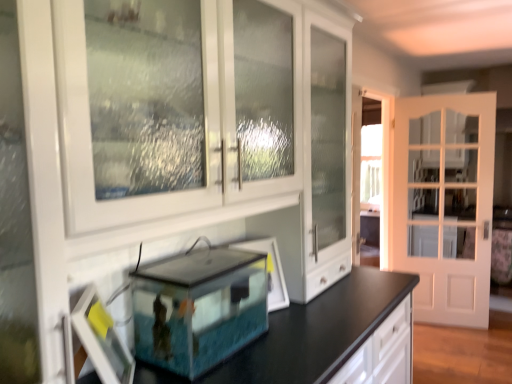
Question: Does clear glass picture frame at center, acting as the first picture frame starting from the right, contain white glossy cabinet at center?

Choices:
 (A) yes
 (B) no

Answer: (B)

Question: From a real-world perspective, is clear glass picture frame at center, positioned as the 2th picture frame in left-to-right order, below white glossy cabinet at center?

Choices:
 (A) no
 (B) yes

Answer: (B)

Question: Is clear glass picture frame at center, arranged as the second picture frame when viewed from the front, shorter than white glossy cabinet at center?

Choices:
 (A) no
 (B) yes

Answer: (B)

Question: From a real-world perspective, is clear glass picture frame at center, acting as the first picture frame starting from the right, located higher than white glossy cabinet at center?

Choices:
 (A) no
 (B) yes

Answer: (A)

Question: From the image's perspective, is clear glass picture frame at center, the 1th picture frame from the back, on top of white glossy cabinet at center?

Choices:
 (A) yes
 (B) no

Answer: (B)

Question: Is white glossy cabinet at center inside or outside of clear glass picture frame at center, the 1th picture frame from the back?

Choices:
 (A) inside
 (B) outside

Answer: (B)

Question: Is white glossy cabinet at center wider or thinner than clear glass picture frame at center, acting as the first picture frame starting from the right?

Choices:
 (A) thin
 (B) wide

Answer: (B)

Question: Is point (19, 21) positioned closer to the camera than point (272, 284)?

Choices:
 (A) closer
 (B) farther

Answer: (A)

Question: From a real-world perspective, is white glossy cabinet at center physically located above or below clear glass picture frame at center, positioned as the 2th picture frame in left-to-right order?

Choices:
 (A) below
 (B) above

Answer: (B)

Question: From a real-world perspective, is white glossy cabinet at center physically located above or below transparent glass tank at center?

Choices:
 (A) below
 (B) above

Answer: (B)

Question: Looking at their shapes, would you say white glossy cabinet at center is wider or thinner than transparent glass tank at center?

Choices:
 (A) thin
 (B) wide

Answer: (B)

Question: Considering the positions of white glossy cabinet at center and transparent glass tank at center in the image, is white glossy cabinet at center bigger or smaller than transparent glass tank at center?

Choices:
 (A) big
 (B) small

Answer: (A)

Question: Is white glossy cabinet at center inside the boundaries of transparent glass tank at center, or outside?

Choices:
 (A) inside
 (B) outside

Answer: (B)

Question: From the image's perspective, is matte white picture frame at lower left, the 1th picture frame from the front, located above or below transparent glass tank at center?

Choices:
 (A) above
 (B) below

Answer: (B)

Question: From a real-world perspective, is matte white picture frame at lower left, positioned as the 2th picture frame in right-to-left order, above or below transparent glass tank at center?

Choices:
 (A) below
 (B) above

Answer: (A)